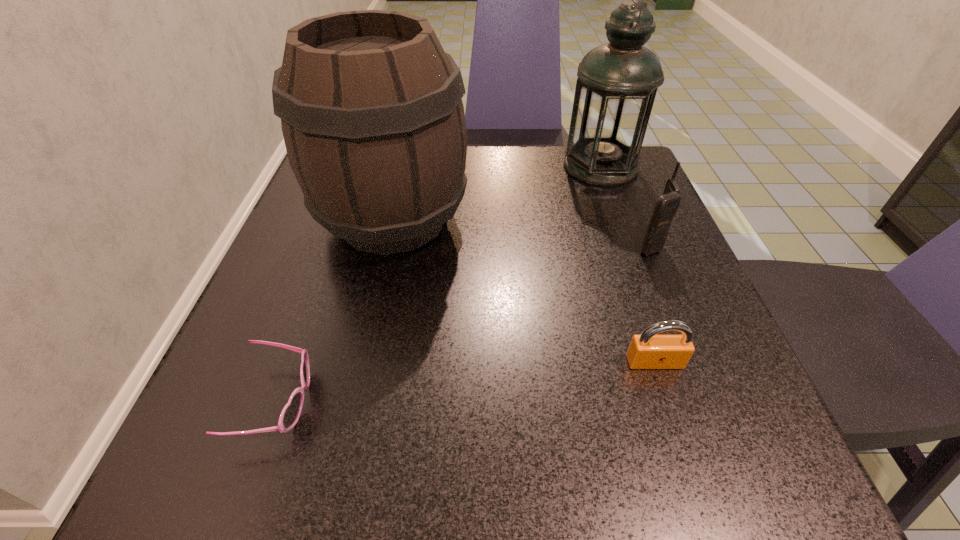
I want to click on free space located to unlock the second shortest object from the front, so click(695, 484).

You are a GUI agent. You are given a task and a screenshot of the screen. Output one action in this format:
    pyautogui.click(x=<x>, y=<y>)
    Task: Click on the vacant space situated 0.390m on the front-facing side of the shortest object
    Image resolution: width=960 pixels, height=540 pixels.
    Given the screenshot: What is the action you would take?
    pyautogui.click(x=595, y=401)

Identify the location of oil lamp that is at the far edge. Image resolution: width=960 pixels, height=540 pixels. pyautogui.click(x=617, y=82).

You are a GUI agent. You are given a task and a screenshot of the screen. Output one action in this format:
    pyautogui.click(x=<x>, y=<y>)
    Task: Click on the wine bucket located in the far edge section of the desktop
    
    Given the screenshot: What is the action you would take?
    pyautogui.click(x=371, y=109)

Identify the location of object positioned at the near edge. pyautogui.click(x=290, y=414).

This screenshot has width=960, height=540. I want to click on wine bucket located at the left edge, so click(x=371, y=109).

In order to click on sunglasses that is at the left edge in this screenshot , I will do `click(290, 414)`.

In order to click on oil lamp that is at the right edge in this screenshot , I will do `click(617, 82)`.

I want to click on cellular telephone that is at the right edge, so click(x=666, y=206).

The width and height of the screenshot is (960, 540). Identify the location of padlock at the right edge. (646, 351).